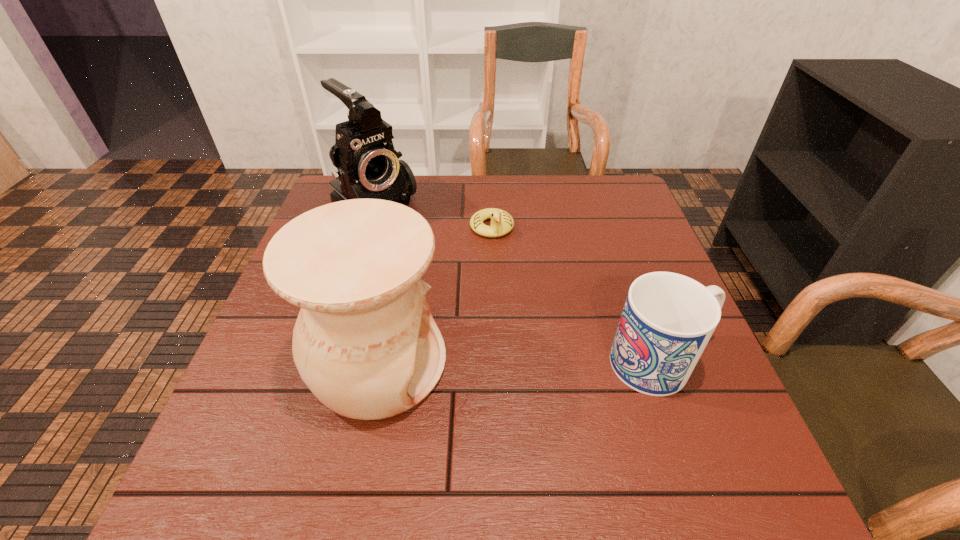
The height and width of the screenshot is (540, 960). What are the coordinates of `pottery` in the screenshot? It's located at (365, 343).

Where is `the second shortest object`? The width and height of the screenshot is (960, 540). the second shortest object is located at coordinates (668, 318).

Where is `mug`? mug is located at coordinates [x=668, y=318].

This screenshot has width=960, height=540. Find the location of `camcorder`. camcorder is located at coordinates (368, 167).

The image size is (960, 540). Identify the location of the shortest object. (502, 222).

Where is `the third object from left to right`? the third object from left to right is located at coordinates (502, 222).

The image size is (960, 540). I want to click on free space located 0.370m at the open side of the pottery, so click(x=632, y=363).

This screenshot has height=540, width=960. I want to click on vacant position located on the left of the mug, so click(x=465, y=363).

You are a GUI agent. You are given a task and a screenshot of the screen. Output one action in this format:
    pyautogui.click(x=<x>, y=<y>)
    Task: Click on the free spot located on the lens mount of the camcorder
    
    Given the screenshot: What is the action you would take?
    pyautogui.click(x=471, y=307)

What are the coordinates of `free space located 0.140m on the lens mount of the camcorder` in the screenshot? It's located at (425, 266).